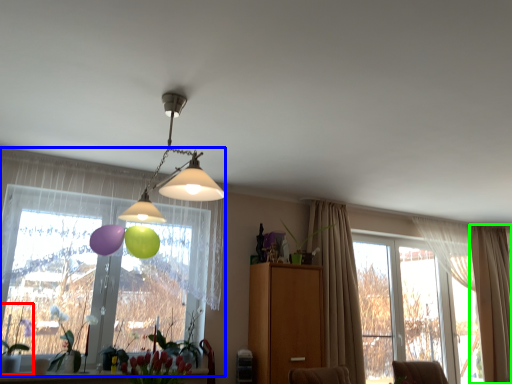
Question: Which object is the farthest from plant (highlighted by a red box)? Choose among these: window (highlighted by a blue box) or curtain (highlighted by a green box).

Choices:
 (A) window
 (B) curtain

Answer: (B)